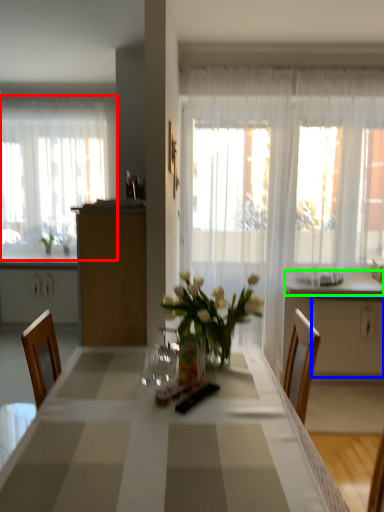
Question: Which object is the closest to the curtain (highlighted by a red box)? Choose among these: radiator (highlighted by a blue box) or counter top (highlighted by a green box).

Choices:
 (A) radiator
 (B) counter top

Answer: (B)